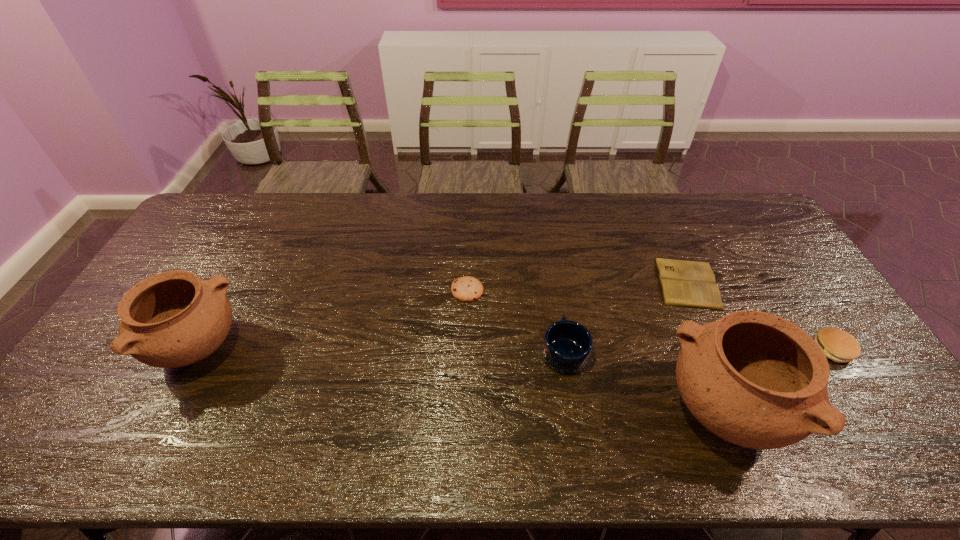
Locate an element on the screen. The image size is (960, 540). free point that satisfies the following two spatial constraints: 1. with the handle on the side of the mug; 2. on the right side of the book is located at coordinates (554, 283).

What are the coordinates of `free space that satisfies the following two spatial constraints: 1. on the back side of the tallest object; 2. on the left side of the fourth tallest object` in the screenshot? It's located at (698, 349).